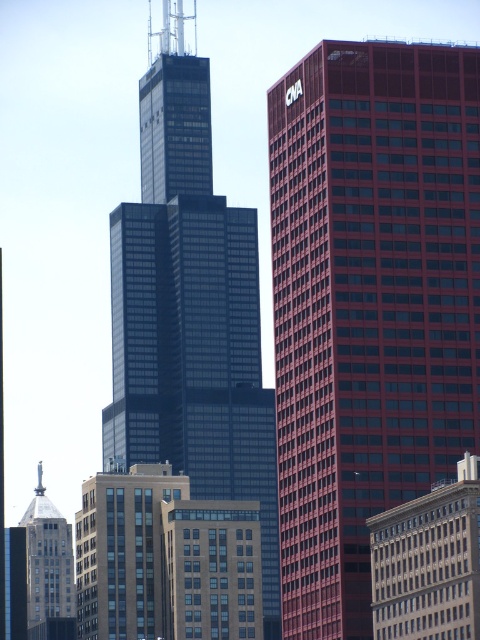
Question: Considering the real-world distances, which object is closest to the brick building at lower right?

Choices:
 (A) dark glass skyscraper at center
 (B) smooth glass building at right

Answer: (B)

Question: Where is dark glass skyscraper at center located in relation to brick building at lower right in the image?

Choices:
 (A) above
 (B) below

Answer: (A)

Question: Which of the following is the closest to the observer?

Choices:
 (A) (54, 548)
 (B) (225, 257)

Answer: (B)

Question: In this image, where is brick building at lower right located relative to silver metallic statue at upper left?

Choices:
 (A) right
 (B) left

Answer: (A)

Question: Does dark glass skyscraper at center appear over silver metallic statue at upper left?

Choices:
 (A) yes
 (B) no

Answer: (A)

Question: Considering the real-world distances, which object is farthest from the silver metallic statue at upper left?

Choices:
 (A) dark glass skyscraper at center
 (B) smooth glass building at right

Answer: (B)